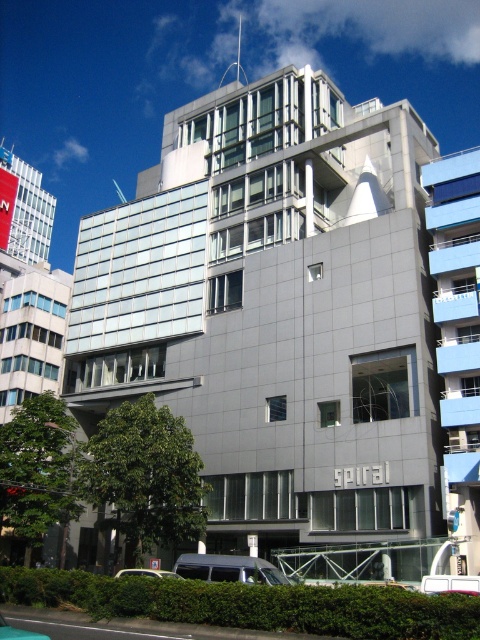
Question: Which point is farther to the camera?

Choices:
 (A) (148, 573)
 (B) (180, 573)
 (C) (0, 618)

Answer: (B)

Question: Does silver metallic van at center appear on the left side of white matte van at lower center?

Choices:
 (A) no
 (B) yes

Answer: (A)

Question: Can you confirm if silver metallic van at center is bigger than metallic silver van at lower left?

Choices:
 (A) no
 (B) yes

Answer: (B)

Question: Which point is closer to the camera taking this photo?

Choices:
 (A) (12, 637)
 (B) (163, 572)
 (C) (218, 572)

Answer: (A)

Question: Is silver metallic van at center smaller than white matte van at lower center?

Choices:
 (A) yes
 (B) no

Answer: (A)

Question: Which of the following is the farthest from the observer?

Choices:
 (A) silver metallic van at center
 (B) metallic silver van at lower left

Answer: (A)